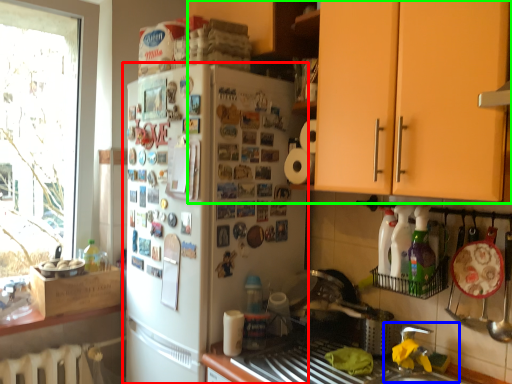
Question: Based on their relative distances, which object is farther from refrigerator (highlighted by a red box)? Choose from sink (highlighted by a blue box) and cabinetry (highlighted by a green box).

Choices:
 (A) sink
 (B) cabinetry

Answer: (A)